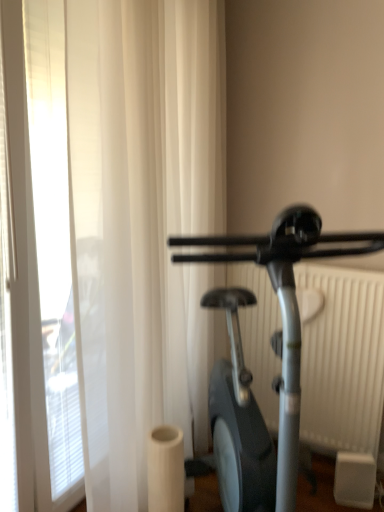
Question: Should I look upward or downward to see silver metallic stationary bicycle at right?

Choices:
 (A) up
 (B) down

Answer: (B)

Question: From the image's perspective, is white sheer curtain at left located above silver metallic stationary bicycle at right?

Choices:
 (A) yes
 (B) no

Answer: (A)

Question: Can you confirm if white sheer curtain at left is bigger than silver metallic stationary bicycle at right?

Choices:
 (A) yes
 (B) no

Answer: (B)

Question: Is white sheer curtain at left shorter than silver metallic stationary bicycle at right?

Choices:
 (A) yes
 (B) no

Answer: (B)

Question: From a real-world perspective, is white sheer curtain at left positioned over silver metallic stationary bicycle at right based on gravity?

Choices:
 (A) no
 (B) yes

Answer: (B)

Question: Is silver metallic stationary bicycle at right a part of white sheer curtain at left?

Choices:
 (A) no
 (B) yes

Answer: (A)

Question: Is white sheer curtain at left further to camera compared to silver metallic stationary bicycle at right?

Choices:
 (A) no
 (B) yes

Answer: (B)

Question: Is the depth of silver metallic stationary bicycle at right less than that of white plastic radiator at right?

Choices:
 (A) no
 (B) yes

Answer: (B)

Question: Considering the relative sizes of silver metallic stationary bicycle at right and white plastic radiator at right in the image provided, is silver metallic stationary bicycle at right shorter than white plastic radiator at right?

Choices:
 (A) yes
 (B) no

Answer: (B)

Question: Is silver metallic stationary bicycle at right oriented towards white plastic radiator at right?

Choices:
 (A) yes
 (B) no

Answer: (B)

Question: Can you confirm if silver metallic stationary bicycle at right is thinner than white plastic radiator at right?

Choices:
 (A) yes
 (B) no

Answer: (B)

Question: Are silver metallic stationary bicycle at right and white plastic radiator at right far apart?

Choices:
 (A) no
 (B) yes

Answer: (A)

Question: Is white plastic radiator at right located within silver metallic stationary bicycle at right?

Choices:
 (A) yes
 (B) no

Answer: (B)

Question: Can you confirm if white sheer curtain at left is bigger than white plastic radiator at right?

Choices:
 (A) no
 (B) yes

Answer: (B)